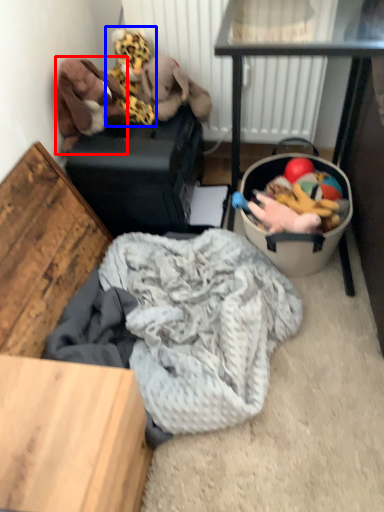
Question: Which of the following is the closest to the observer, toy (highlighted by a red box) or toy (highlighted by a blue box)?

Choices:
 (A) toy
 (B) toy

Answer: (A)